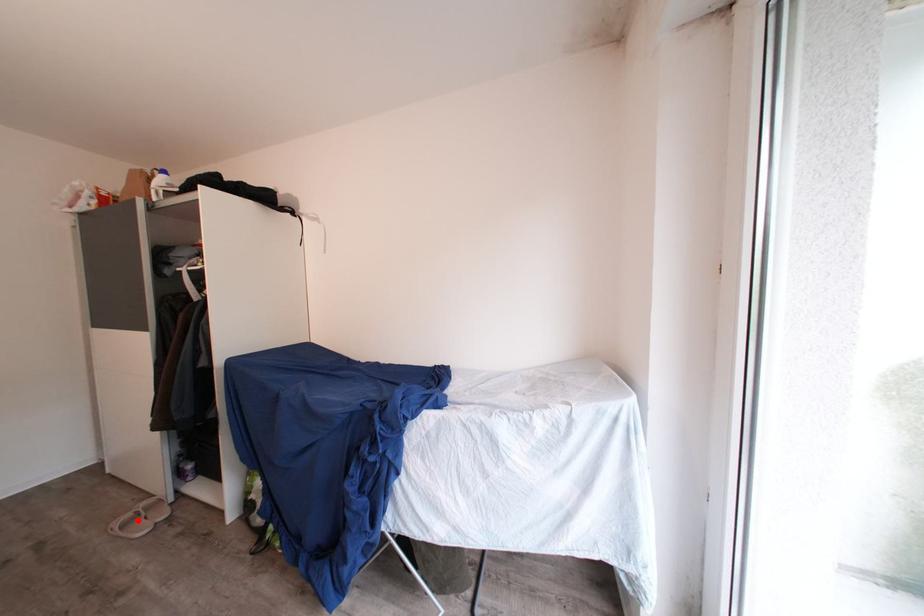
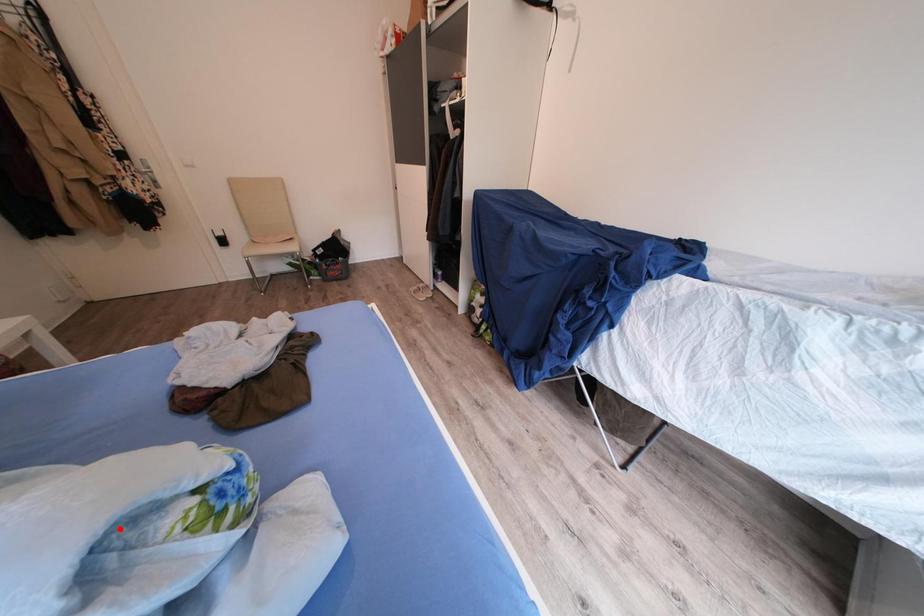
I am providing you with two images of the same scene from different viewpoints. A red point is marked on the first image and another point is marked on the second image. Is the marked point in image1 the same physical position as the marked point in image2?

No